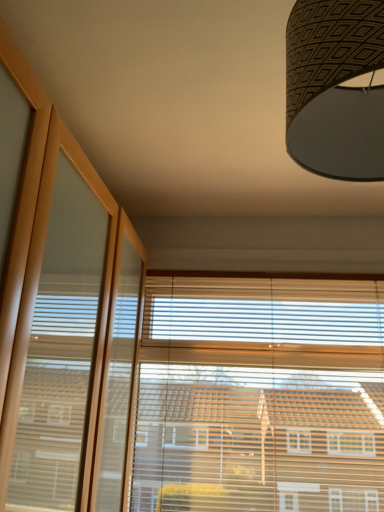
Question: From a real-world perspective, is wooden blinds at center positioned above or below textured brown lampshade at upper right?

Choices:
 (A) above
 (B) below

Answer: (B)

Question: Considering the positions of wooden blinds at center and textured brown lampshade at upper right in the image, is wooden blinds at center bigger or smaller than textured brown lampshade at upper right?

Choices:
 (A) big
 (B) small

Answer: (A)

Question: Is point (203, 497) positioned closer to the camera than point (326, 172)?

Choices:
 (A) farther
 (B) closer

Answer: (A)

Question: In the image, is textured brown lampshade at upper right positioned in front of or behind wooden blinds at center?

Choices:
 (A) front
 (B) behind

Answer: (A)

Question: Considering the positions of textured brown lampshade at upper right and wooden blinds at center in the image, is textured brown lampshade at upper right wider or thinner than wooden blinds at center?

Choices:
 (A) thin
 (B) wide

Answer: (B)

Question: Based on their positions, is textured brown lampshade at upper right located to the left or right of wooden blinds at center?

Choices:
 (A) right
 (B) left

Answer: (B)

Question: Based on their sizes in the image, would you say textured brown lampshade at upper right is bigger or smaller than wooden blinds at center?

Choices:
 (A) small
 (B) big

Answer: (A)